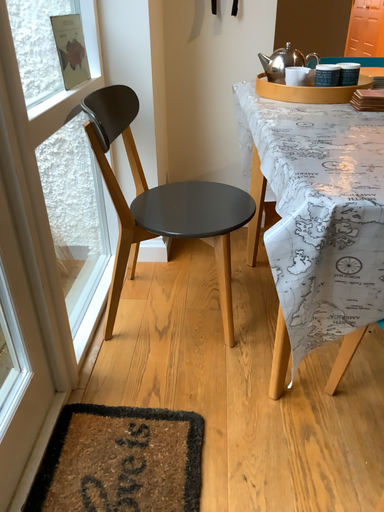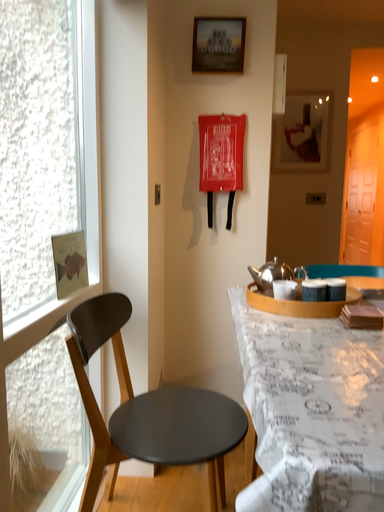
Question: How did the camera likely rotate when shooting the video?

Choices:
 (A) rotated downward
 (B) rotated upward

Answer: (B)